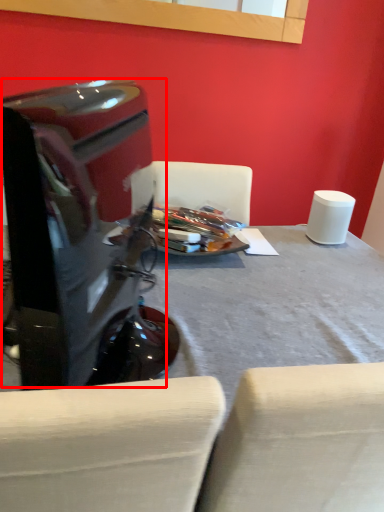
Question: From the image, what is the correct spatial relationship of computer monitor (annotated by the red box) in relation to table?

Choices:
 (A) right
 (B) left

Answer: (B)